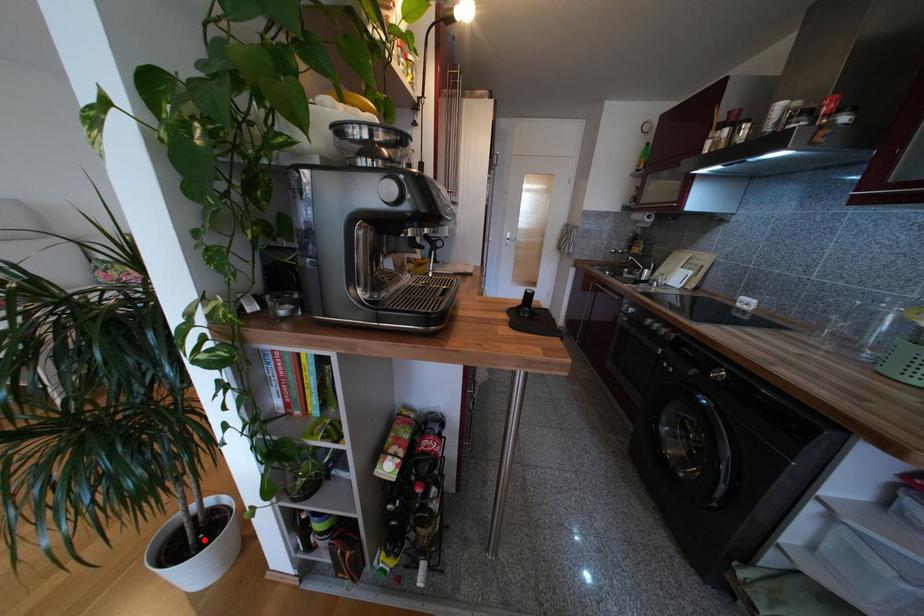
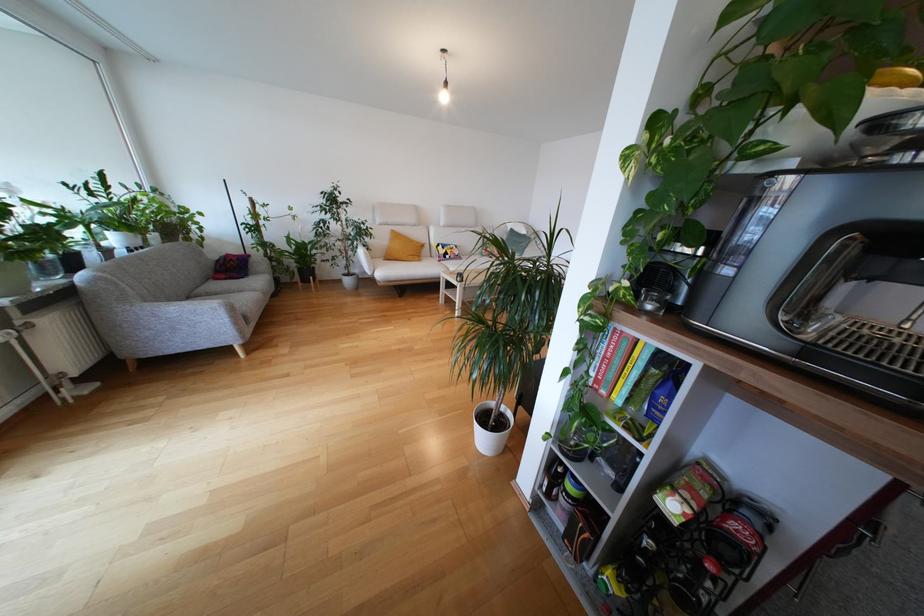
The point at the highlighted location is marked in the first image. Where is the corresponding point in the second image?

(497, 427)